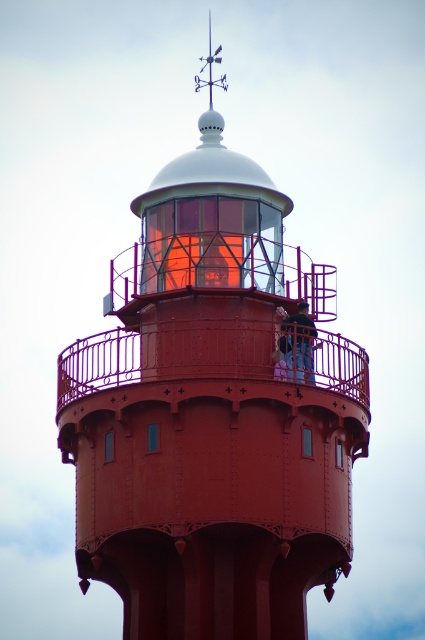
You are standing at the base of the lighthouse and looking towards the two points marked in the image. Which point, point (229, 164) or point (297, 378), is closer to you?

Point (297, 378) is closer to you because it is in front of point (229, 164).

You are a photographer trying to capture the smooth red lighthouse at center and the blue denim jeans at center in the same frame. Can you position yourself so that both objects are fully visible without any obstruction?

The smooth red lighthouse at center is in front of the blue denim jeans at center, so the lighthouse will block part of the blue denim jeans at center. Therefore, it might be challenging to capture both fully visible without obstruction.

Looking at this image, you are a photographer trying to capture the smooth red lighthouse at center and the blue denim jeans at center in a single frame. Based on their sizes, which object should you focus on first to ensure both are clearly visible in the photo?

The smooth red lighthouse at center is larger than the blue denim jeans at center, so focus on the lighthouse first to ensure both are in frame and clearly visible.